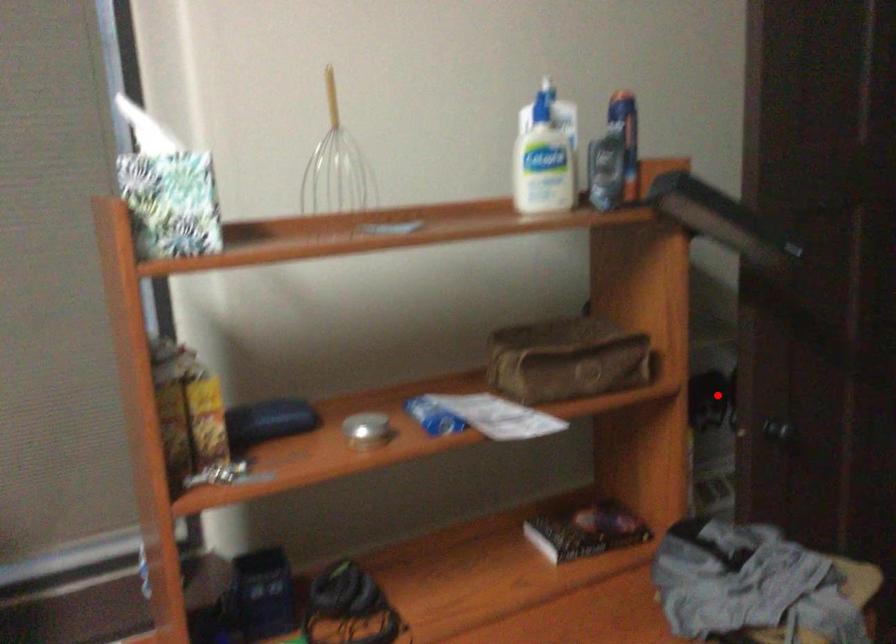
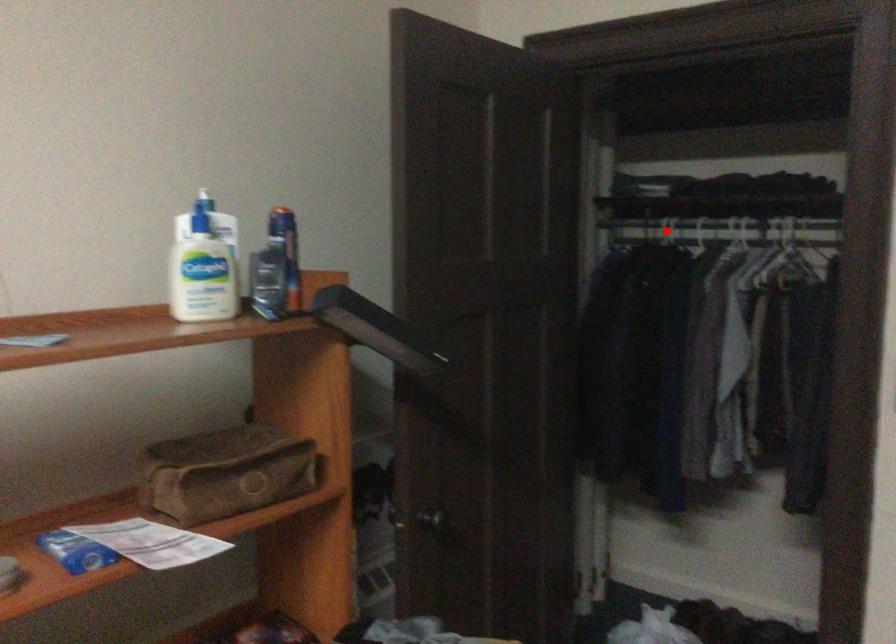
From the picture: I am providing you with two images of the same scene from different viewpoints. A red point is marked on the first image and another point is marked on the second image. Is the marked point in image1 the same physical position as the marked point in image2?

No